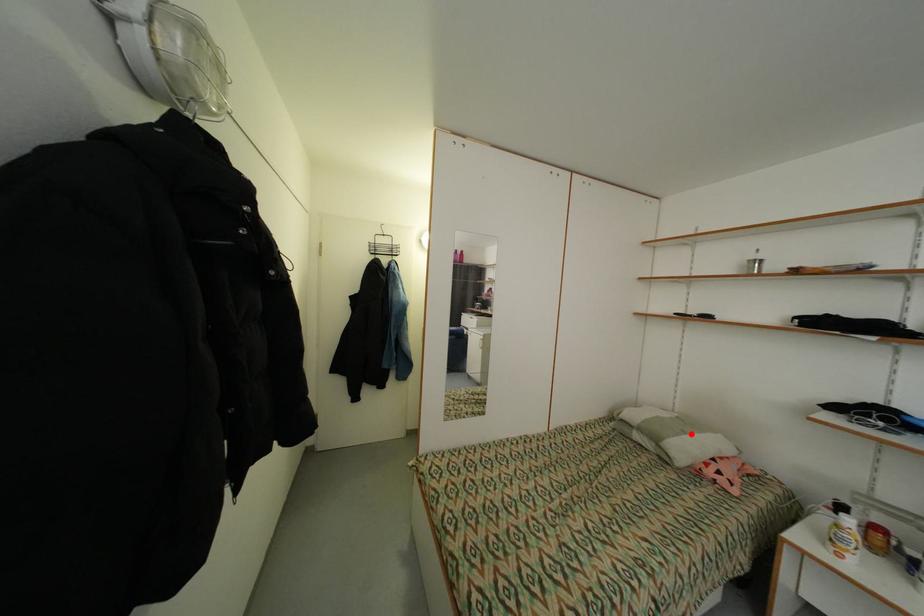
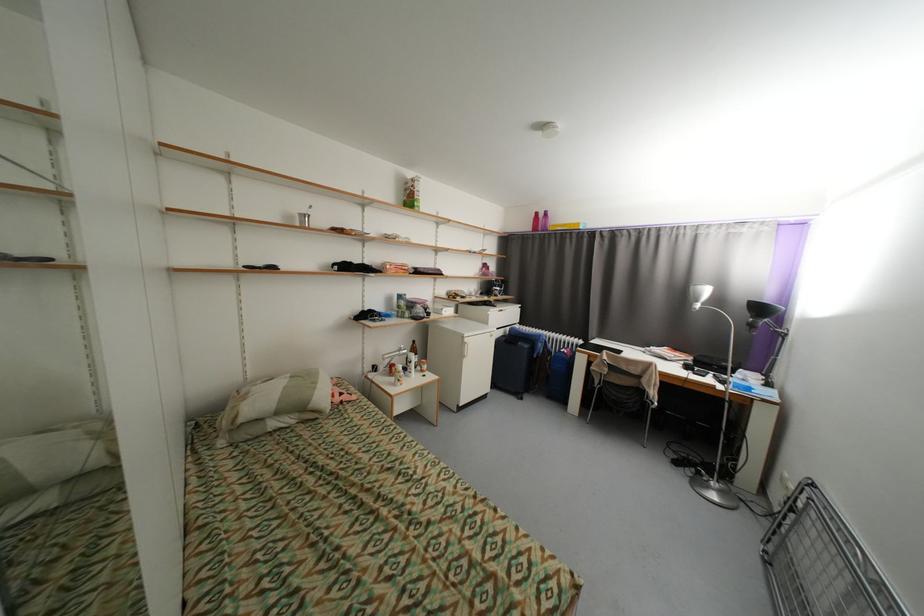
Question: I am providing you with two images of the same scene from different viewpoints. Image1 has a red point marked. In image2, the corresponding 3D location appears at what relative position? Reply with the corresponding letter.

Choices:
 (A) Closer
 (B) Farther

Answer: (A)